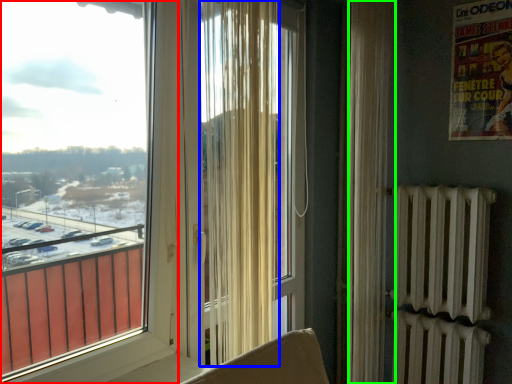
Question: Which object is positioned closest to window (highlighted by a red box)? Select from curtain (highlighted by a blue box) and curtain (highlighted by a green box).

Choices:
 (A) curtain
 (B) curtain

Answer: (A)